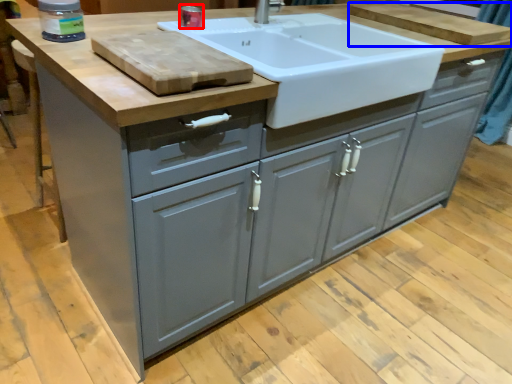
Question: Among these objects, which one is nearest to the camera, appliance (highlighted by a red box) or cutting board (highlighted by a blue box)?

Choices:
 (A) appliance
 (B) cutting board

Answer: (A)